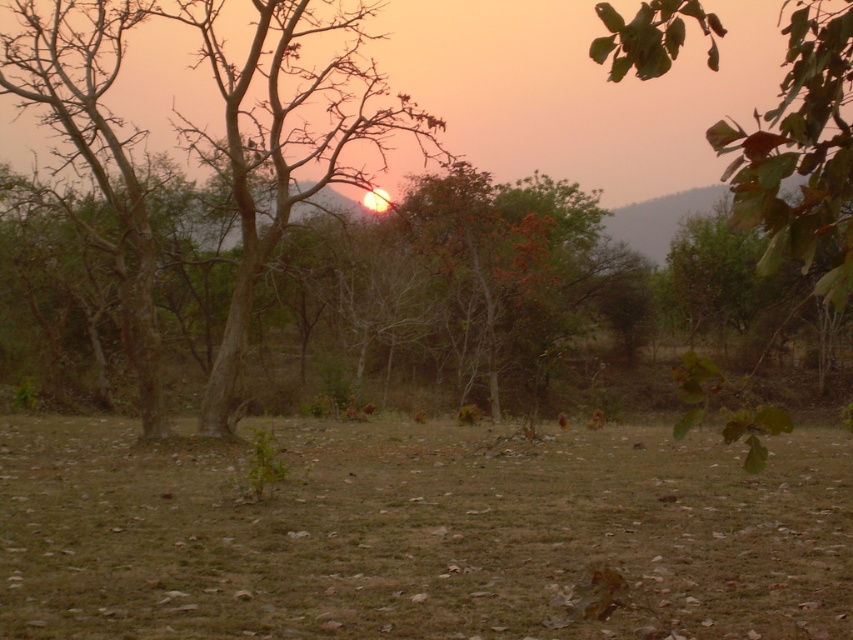
Between point (376, 506) and point (258, 257), which one is positioned behind?

The point (258, 257) is more distant.

Who is more forward, [35,561] or [808,250]?

Point [808,250] is in front.

The image size is (853, 640). Find the location of `brown grass at center`. brown grass at center is located at coordinates (421, 536).